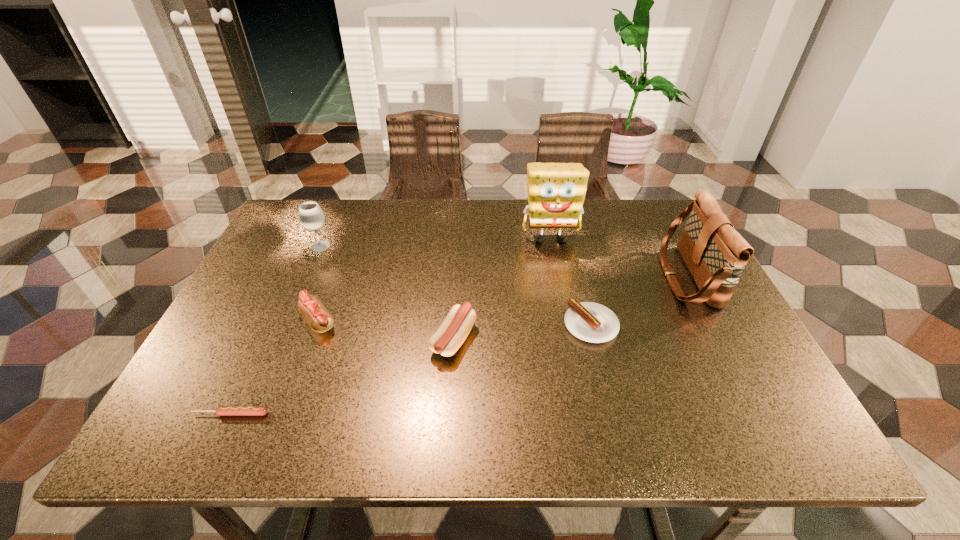
Find the location of a particular element. The width and height of the screenshot is (960, 540). sponge is located at coordinates (556, 191).

Find the location of a particular element. The image size is (960, 540). the second tallest object is located at coordinates (715, 253).

The image size is (960, 540). I want to click on the rightmost object, so click(x=715, y=253).

At what (x,y) coordinates should I click in order to perform the action: click on wineglass. Please return your answer as a coordinate pair (x, y). The image size is (960, 540). Looking at the image, I should click on (311, 216).

The image size is (960, 540). Identify the location of the third sausage from left to right. (449, 337).

Locate an element on the screen. The height and width of the screenshot is (540, 960). the second shortest sausage is located at coordinates (591, 322).

At what (x,y) coordinates should I click in order to perform the action: click on the rightmost sausage. Please return your answer as a coordinate pair (x, y). Looking at the image, I should click on (591, 322).

Find the location of a particular element. the nearest sausage is located at coordinates (221, 410).

The image size is (960, 540). I want to click on the nearest object, so click(221, 410).

In order to click on vacant space located 0.050m on the face of the sponge in this screenshot , I will do `click(555, 263)`.